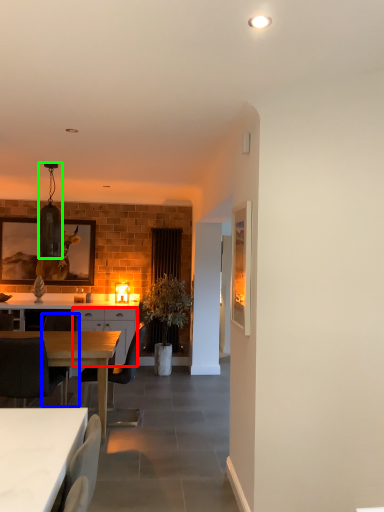
Question: Which object is positioned farthest from cabinetry (highlighted by a red box)? Select from chair (highlighted by a blue box) and lamp (highlighted by a green box).

Choices:
 (A) chair
 (B) lamp

Answer: (B)